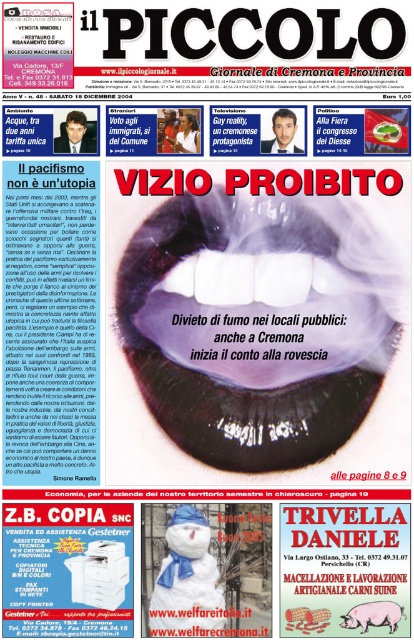
Can you confirm if white glossy teeth at center is smaller than white fluffy snowman at center?

Actually, white glossy teeth at center might be larger than white fluffy snowman at center.

Measure the distance between point [173,358] and camera.

A distance of 1.41 meters exists between point [173,358] and camera.

You are a GUI agent. You are given a task and a screenshot of the screen. Output one action in this format:
    pyautogui.click(x=<x>, y=<y>)
    Task: Click on the white glossy teeth at center
    
    Given the screenshot: What is the action you would take?
    pyautogui.click(x=257, y=324)